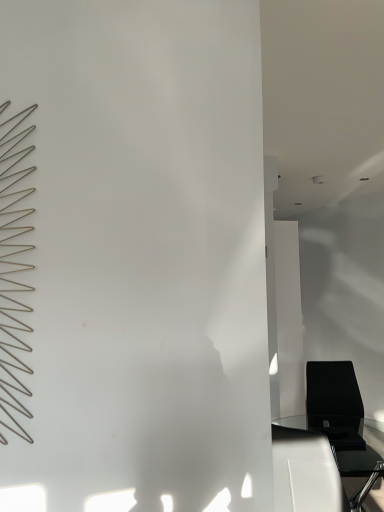
Question: Should I look upward or downward to see black leather chair at lower right?

Choices:
 (A) up
 (B) down

Answer: (B)